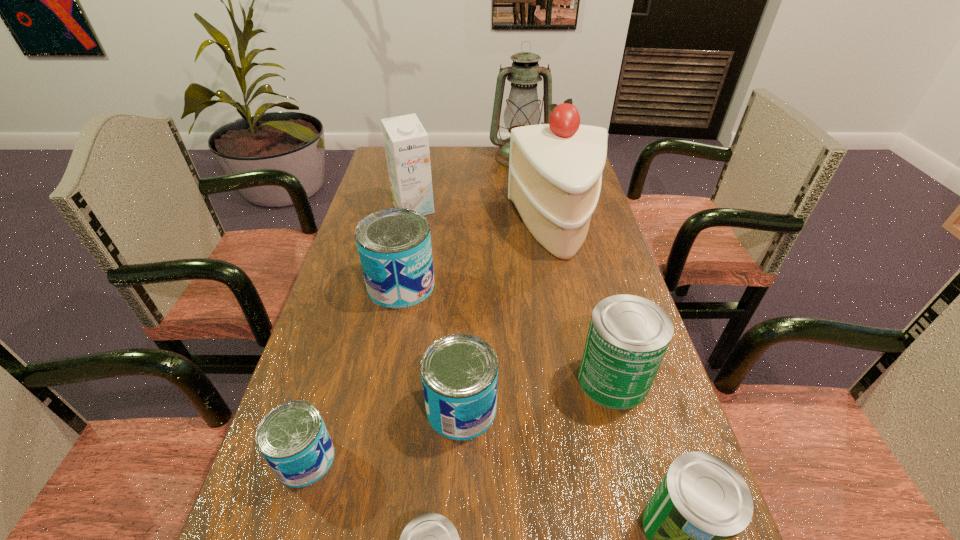
Where is `can that stands as the third closest to the eighth shortest object`? This screenshot has height=540, width=960. can that stands as the third closest to the eighth shortest object is located at coordinates (459, 372).

Find the location of a particular element. The width and height of the screenshot is (960, 540). blue can that is the second nearest to the farthest green can is located at coordinates (394, 245).

Select which blue can appears as the second closest to the leftmost green can. Please provide its 2D coordinates. Your answer should be formatted as a tuple, i.e. [(x, y)], where the tuple contains the x and y coordinates of a point satisfying the conditions above.

[(293, 439)]

Identify the location of green can that is the second closest to the farthest blue can. (430, 539).

At what (x,y) coordinates should I click in order to perform the action: click on green can identified as the closest to the farthest blue can. Please return your answer as a coordinate pair (x, y). The height and width of the screenshot is (540, 960). Looking at the image, I should click on (628, 336).

The height and width of the screenshot is (540, 960). Identify the location of vacant position in the image that satisfies the following two spatial constraints: 1. on the back side of the farthest object; 2. on the left side of the biggest blue can. (426, 158).

Locate an element on the screen. The image size is (960, 540). vacant position in the image that satisfies the following two spatial constraints: 1. on the back side of the smallest blue can; 2. on the left side of the carton is located at coordinates (381, 209).

I want to click on vacant area that satisfies the following two spatial constraints: 1. on the front side of the farthest blue can; 2. on the left side of the biggest green can, so click(x=383, y=380).